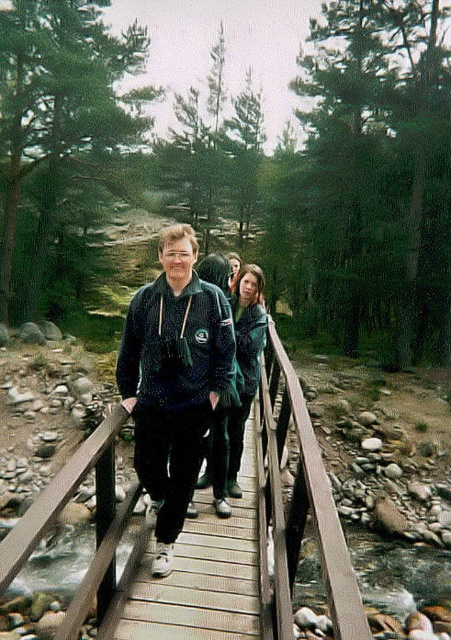
Does wooden at center have a lesser height compared to dark blue fleece at center?

Incorrect, wooden at center's height does not fall short of dark blue fleece at center's.

Who is positioned more to the right, wooden at center or dark blue fleece at center?

wooden at center

Does point (279, 442) come closer to viewer compared to point (147, 387)?

That is False.

Identify the location of wooden at center. Image resolution: width=451 pixels, height=640 pixels. (295, 508).

Who is positioned more to the right, dark blue fleece at center or dark blue hoodie at center?

Positioned to the right is dark blue hoodie at center.

Is point (188, 257) more distant than point (233, 467)?

No, it is not.

What do you see at coordinates (174, 380) in the screenshot?
I see `dark blue fleece at center` at bounding box center [174, 380].

Locate an element on the screen. The image size is (451, 640). dark blue fleece at center is located at coordinates (174, 380).

Is wooden at center thinner than dark blue hoodie at center?

Yes.

Is wooden at center shorter than dark blue hoodie at center?

Yes.

Who is more forward, [115,538] or [257,378]?

Point [115,538] is in front.

The height and width of the screenshot is (640, 451). Identify the location of wooden at center. (295, 508).